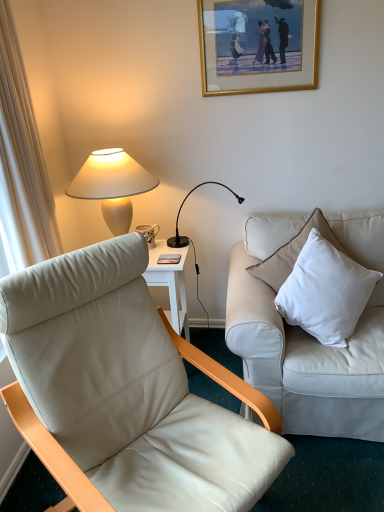
Question: From a real-world perspective, is white leather couch at right on top of black metal/texture desk lamp at upper center, the first lamp from the right?

Choices:
 (A) yes
 (B) no

Answer: (B)

Question: Does white leather couch at right appear on the left side of black metal/texture desk lamp at upper center, the first lamp from the right?

Choices:
 (A) no
 (B) yes

Answer: (A)

Question: Is white leather couch at right behind black metal/texture desk lamp at upper center, which ranks as the 2th lamp in left-to-right order?

Choices:
 (A) no
 (B) yes

Answer: (A)

Question: From the image's perspective, is white leather couch at right on top of black metal/texture desk lamp at upper center, which ranks as the 2th lamp in left-to-right order?

Choices:
 (A) yes
 (B) no

Answer: (B)

Question: Does white leather couch at right appear on the right side of black metal/texture desk lamp at upper center, which ranks as the 2th lamp in left-to-right order?

Choices:
 (A) yes
 (B) no

Answer: (A)

Question: From the image's perspective, relative to leather chair at left, is white cotton pillow at right above or below?

Choices:
 (A) above
 (B) below

Answer: (A)

Question: In the image, is white cotton pillow at right on the left side or the right side of leather chair at left?

Choices:
 (A) right
 (B) left

Answer: (A)

Question: Is white cotton pillow at right inside the boundaries of leather chair at left, or outside?

Choices:
 (A) outside
 (B) inside

Answer: (A)

Question: From their relative heights in the image, would you say white cotton pillow at right is taller or shorter than leather chair at left?

Choices:
 (A) tall
 (B) short

Answer: (B)

Question: Considering the positions of white cotton pillow at right and black metal/texture desk lamp at upper center, the first lamp from the right, in the image, is white cotton pillow at right wider or thinner than black metal/texture desk lamp at upper center, the first lamp from the right,?

Choices:
 (A) thin
 (B) wide

Answer: (B)

Question: Is white cotton pillow at right situated inside black metal/texture desk lamp at upper center, the first lamp from the right, or outside?

Choices:
 (A) outside
 (B) inside

Answer: (A)

Question: In terms of height, does white cotton pillow at right look taller or shorter compared to black metal/texture desk lamp at upper center, the first lamp from the right?

Choices:
 (A) tall
 (B) short

Answer: (B)

Question: From a real-world perspective, is white cotton pillow at right above or below black metal/texture desk lamp at upper center, which ranks as the 2th lamp in left-to-right order?

Choices:
 (A) above
 (B) below

Answer: (B)

Question: Is black metal/texture desk lamp at upper center, the first lamp from the right, taller or shorter than gold-framed picture at upper center?

Choices:
 (A) tall
 (B) short

Answer: (A)

Question: Is black metal/texture desk lamp at upper center, the first lamp from the right, situated inside gold-framed picture at upper center or outside?

Choices:
 (A) outside
 (B) inside

Answer: (A)